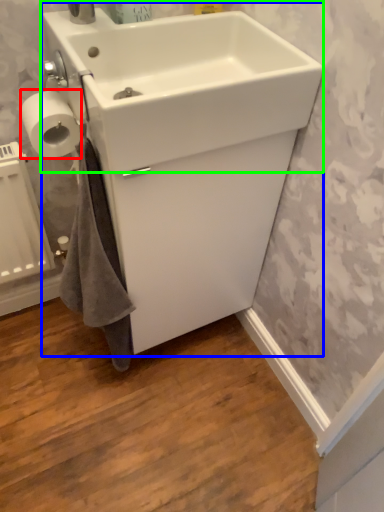
Question: Which is farther away from toilet paper (highlighted by a red box)? sink (highlighted by a blue box) or sink (highlighted by a green box)?

Choices:
 (A) sink
 (B) sink

Answer: (A)